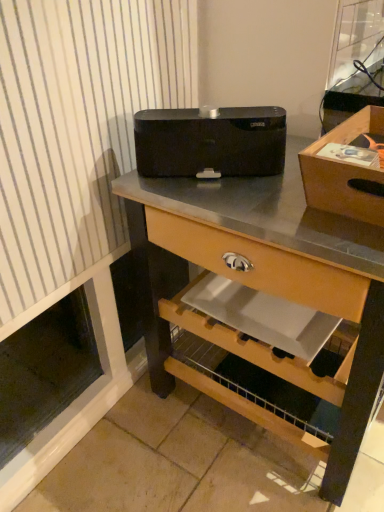
The image size is (384, 512). Identify the location of vacant region above black matte speaker at center (from a real-world perspective). (208, 114).